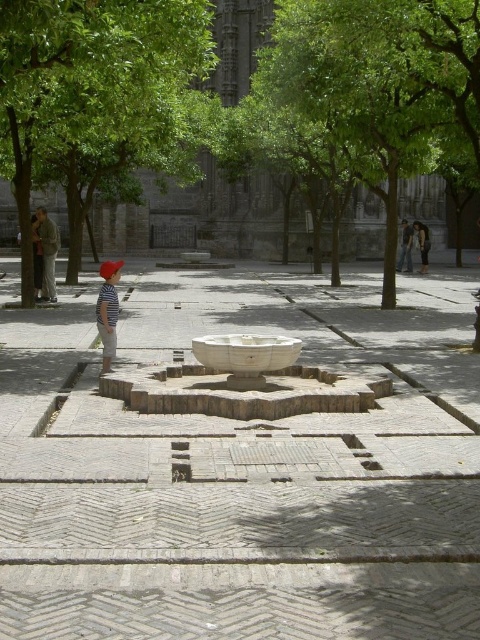
Is green leafy tree at upper left above matte gray statue at left?

Indeed, green leafy tree at upper left is positioned over matte gray statue at left.

Is green leafy tree at upper left wider than matte gray statue at left?

Yes.

Image resolution: width=480 pixels, height=640 pixels. What do you see at coordinates (95, 97) in the screenshot? I see `green leafy tree at upper left` at bounding box center [95, 97].

Image resolution: width=480 pixels, height=640 pixels. In order to click on green leafy tree at upper left in this screenshot , I will do `click(95, 97)`.

Is the position of striped cotton shirt at center less distant than that of denim jacket at center?

That is True.

Does striped cotton shirt at center have a lesser height compared to denim jacket at center?

In fact, striped cotton shirt at center may be taller than denim jacket at center.

The height and width of the screenshot is (640, 480). I want to click on striped cotton shirt at center, so click(x=108, y=308).

Can you confirm if green leafy tree at upper left is wider than denim jacket at center?

Yes.

Can you confirm if green leafy tree at upper left is smaller than denim jacket at center?

No, green leafy tree at upper left is not smaller than denim jacket at center.

Measure the distance between point (123, 33) and camera.

A distance of 84.99 feet exists between point (123, 33) and camera.

The image size is (480, 640). I want to click on green leafy tree at upper left, so click(x=95, y=97).